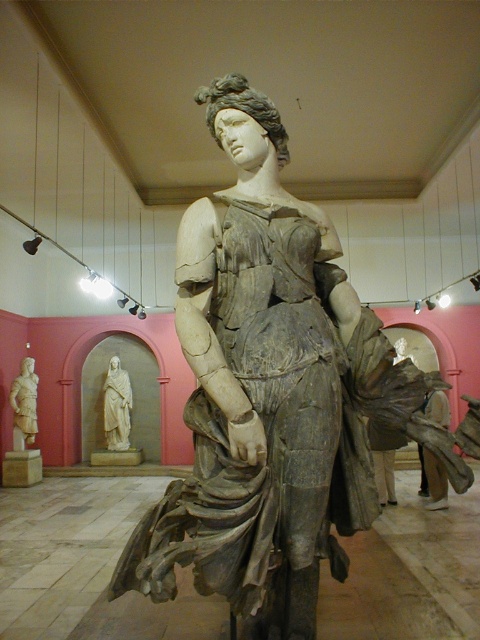
You are an art conservator examining the statue from the front. You notice two points on the statue marked at coordinates point (287, 346) and point (126, 433). Which of these points is closer to you?

Point (287, 346) is closer to the viewer than point (126, 433).

You are an art conservator assessing the space between two statues in a museum. The gray stone statue at center and the light beige marble statue at left are both in your line of sight. Based on their widths, which one is more likely to block your view if you move closer to them?

The gray stone statue at center might be wider than light beige marble statue at left, so it is more likely to block your view if you move closer to them.